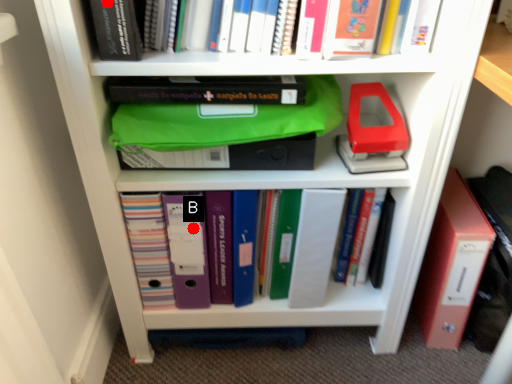
Question: Two points are circled on the image, labeled by A and B beside each circle. Which point appears farthest from the camera in this image?

Choices:
 (A) A is further
 (B) B is further

Answer: (B)